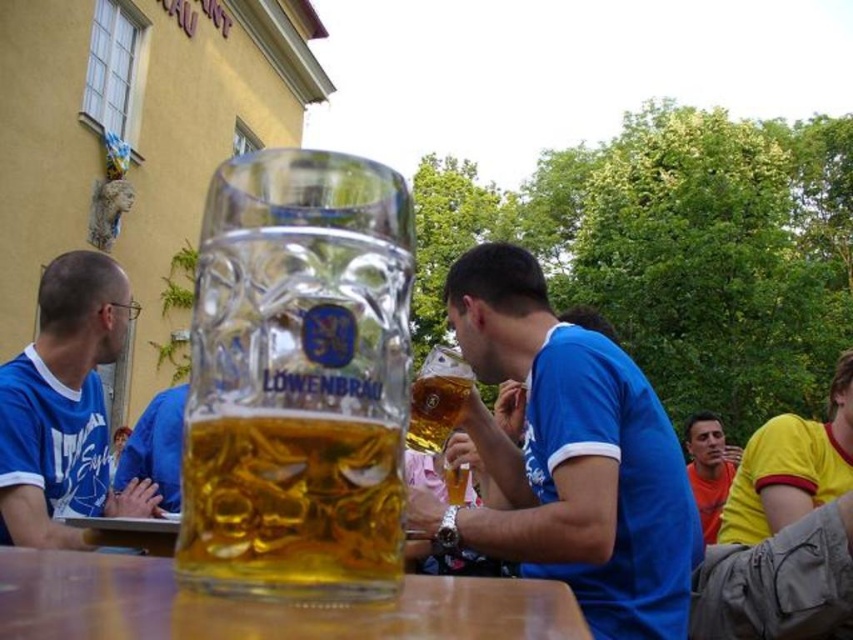
Can you confirm if transparent glass mug at center is taller than matte blue shirt at lower right?

Incorrect, transparent glass mug at center's height is not larger of matte blue shirt at lower right's.

Does transparent glass mug at center appear on the left side of matte blue shirt at lower right?

Correct, you'll find transparent glass mug at center to the left of matte blue shirt at lower right.

Locate an element on the screen. transparent glass mug at center is located at coordinates (299, 380).

Is transparent glass table at center shorter than yellow jersey at right?

Correct, transparent glass table at center is not as tall as yellow jersey at right.

Between transparent glass table at center and yellow jersey at right, which one appears on the left side from the viewer's perspective?

transparent glass table at center

The width and height of the screenshot is (853, 640). I want to click on transparent glass table at center, so click(258, 605).

Between matte blue shirt at lower right and golden glass beer at center, which one has less height?

With less height is golden glass beer at center.

Does matte blue shirt at lower right have a smaller size compared to golden glass beer at center?

No.

Is point (718, 426) farther from viewer compared to point (466, 381)?

Yes, it is behind point (466, 381).

Find the location of a particular element. This screenshot has width=853, height=640. matte blue shirt at lower right is located at coordinates (709, 468).